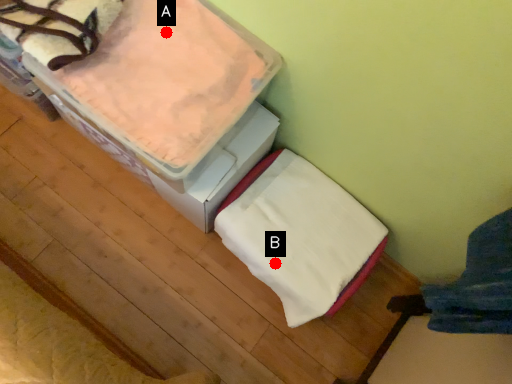
Question: Two points are circled on the image, labeled by A and B beside each circle. Which point is farther from the camera taking this photo?

Choices:
 (A) A is further
 (B) B is further

Answer: (B)